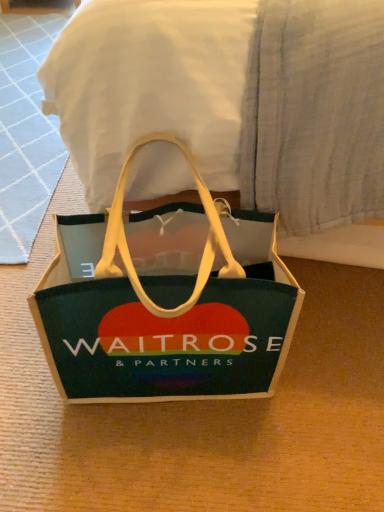
You are a GUI agent. You are given a task and a screenshot of the screen. Output one action in this format:
    pyautogui.click(x=<x>, y=<y>)
    Task: Click on the unoccupied area in front of green felt bag at center
    Image resolution: width=384 pixels, height=512 pixels.
    Given the screenshot: What is the action you would take?
    [159, 465]